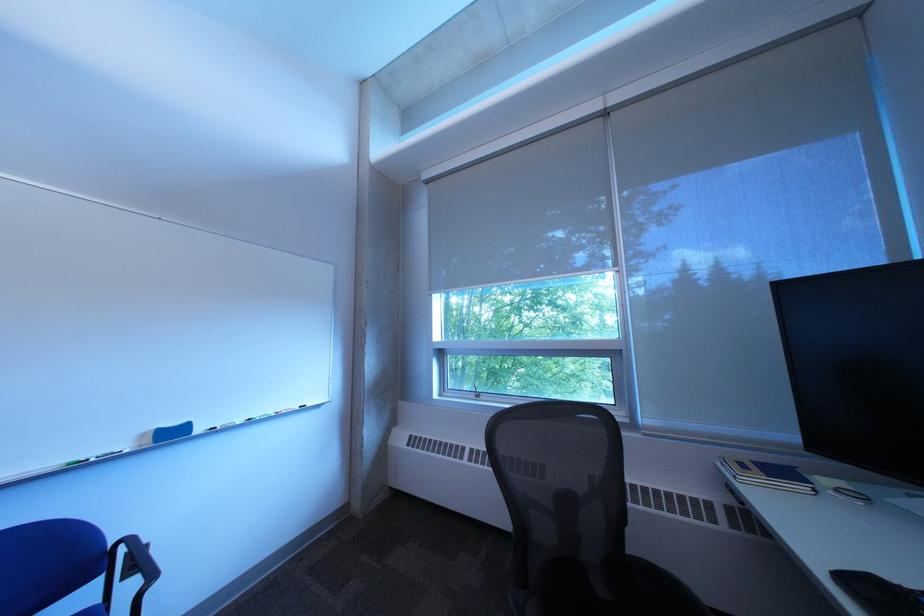
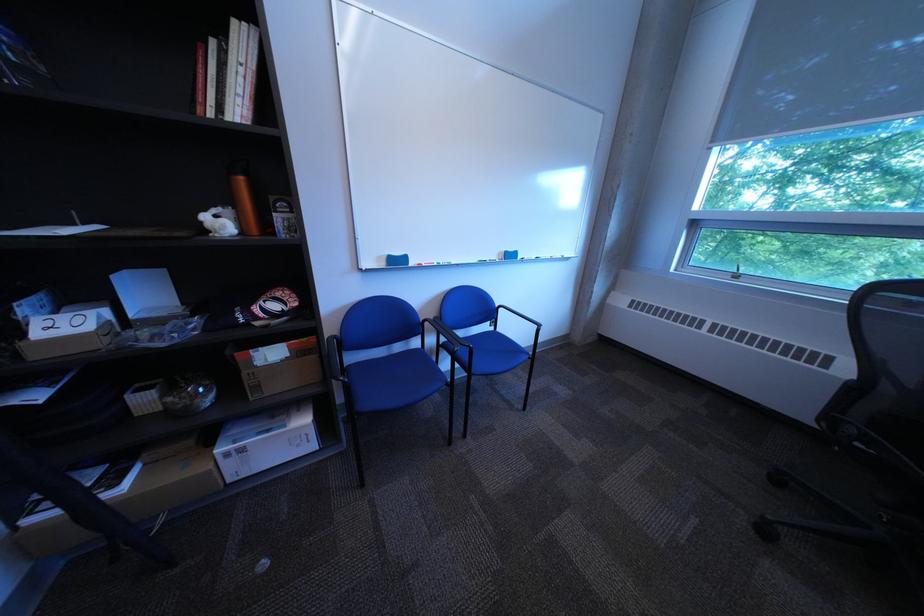
The images are taken continuously from a first-person perspective. In which direction is your viewpoint rotating?

The camera's rotation is toward left-down.